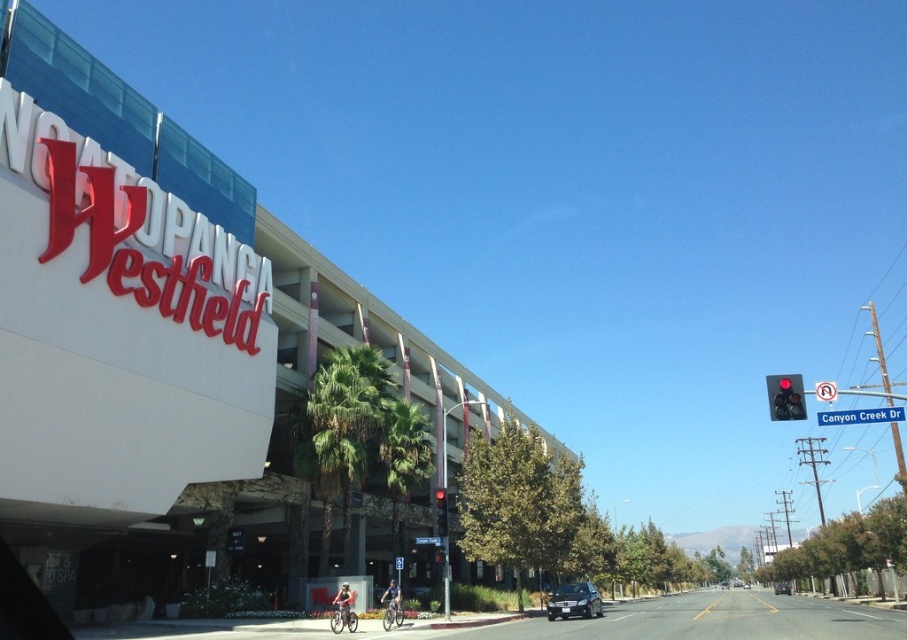
In order to click on satin black sedan at lower center in this screenshot , I will do `click(574, 602)`.

Which is behind, point (564, 602) or point (437, 531)?

Point (564, 602)

Does point (593, 600) lie behind point (439, 497)?

Yes.

Find the location of `satin black sedan at lower center`. satin black sedan at lower center is located at coordinates (574, 602).

Which is more to the left, black plastic traffic light at right or black matte sedan at center?

From the viewer's perspective, black plastic traffic light at right appears more on the left side.

Can you confirm if black plastic traffic light at right is smaller than black matte sedan at center?

Indeed, black plastic traffic light at right has a smaller size compared to black matte sedan at center.

Who is more forward, (x=777, y=412) or (x=776, y=589)?

Point (x=777, y=412)

The height and width of the screenshot is (640, 907). Find the location of `black plastic traffic light at right`. black plastic traffic light at right is located at coordinates click(x=785, y=396).

Between point (826, 419) and point (437, 532), which one is positioned behind?

Point (437, 532)

Who is positioned more to the left, blue plastic street sign at upper right or red glass traffic light at upper right?

red glass traffic light at upper right is more to the left.

At what (x,y) coordinates should I click in order to perform the action: click on blue plastic street sign at upper right. Please return your answer as a coordinate pair (x, y). Image resolution: width=907 pixels, height=640 pixels. Looking at the image, I should click on (860, 416).